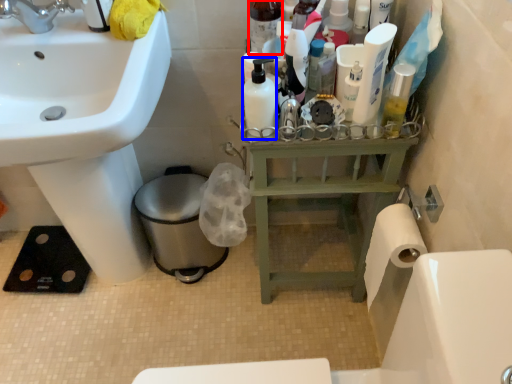
Question: Which object appears farthest to the camera in this image, toiletry (highlighted by a red box) or mouthwash (highlighted by a blue box)?

Choices:
 (A) toiletry
 (B) mouthwash

Answer: (A)